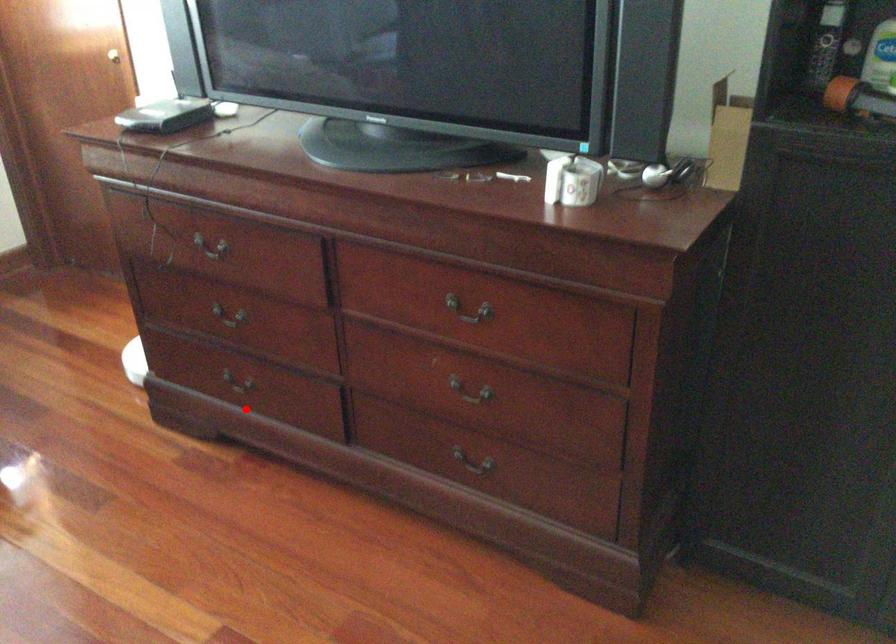
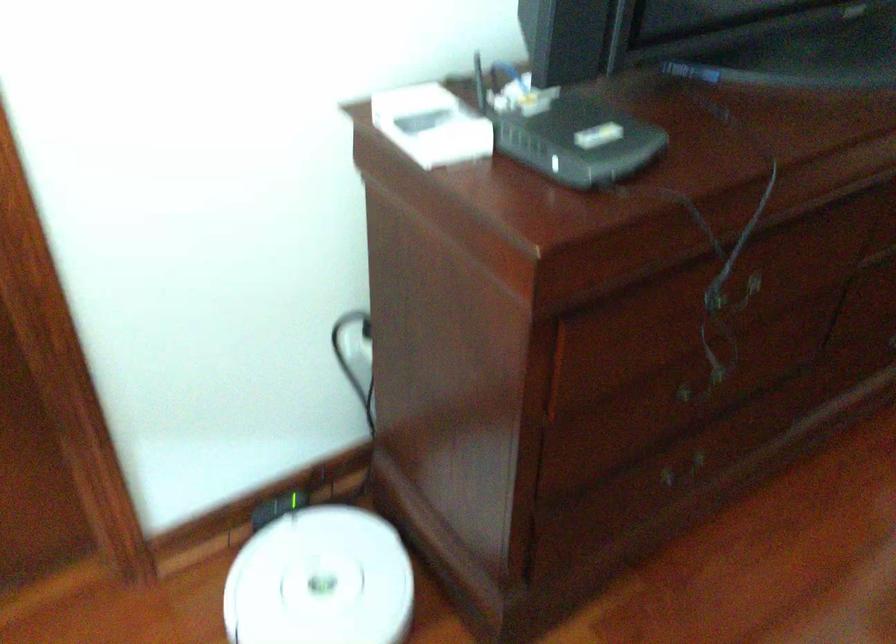
Locate, in the second image, the point that corresponds to the highlighted location in the first image.

(684, 473)